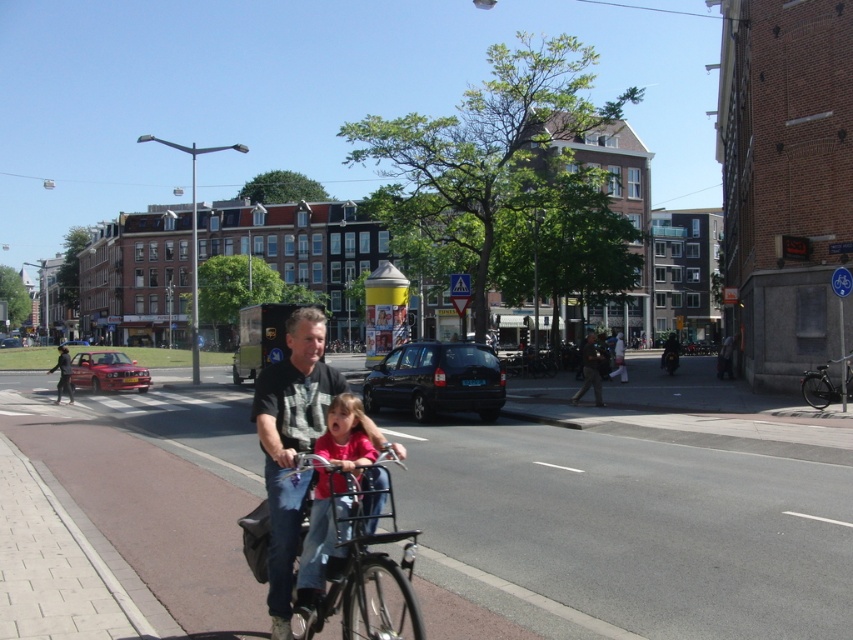
Question: In this image, where is dark gray t-shirt at center located relative to dark gray jacket at center?

Choices:
 (A) above
 (B) below

Answer: (B)

Question: Does metallic silver bicycle at center appear under pink matte shirt at center?

Choices:
 (A) no
 (B) yes

Answer: (B)

Question: Which point is closer to the camera taking this photo?

Choices:
 (A) (300, 593)
 (B) (601, 358)

Answer: (A)

Question: Estimate the real-world distances between objects in this image. Which object is farther from the metallic silver bicycle at center?

Choices:
 (A) pink matte shirt at center
 (B) dark gray t-shirt at center
 (C) black matte bicycle at right

Answer: (C)

Question: Is dark gray t-shirt at center above metallic silver bicycle at center?

Choices:
 (A) no
 (B) yes

Answer: (B)

Question: Which point is farther to the camera?

Choices:
 (A) black matte bicycle at right
 (B) metallic silver bicycle at center

Answer: (A)